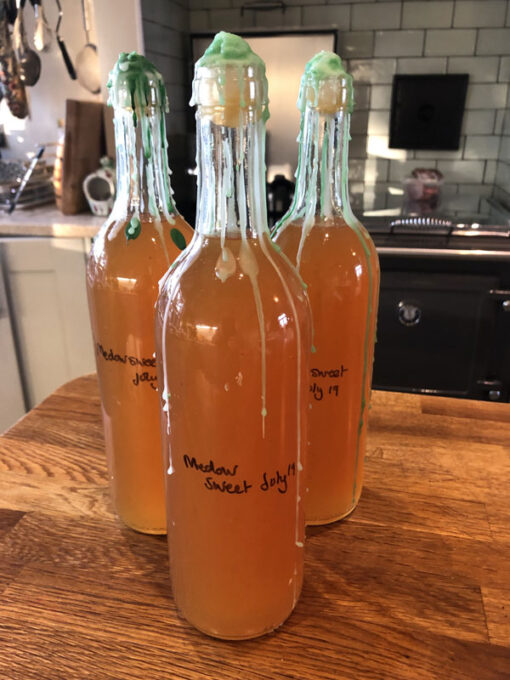
Find the location of a particular element. The width and height of the screenshot is (510, 680). cutting board is located at coordinates (85, 128).